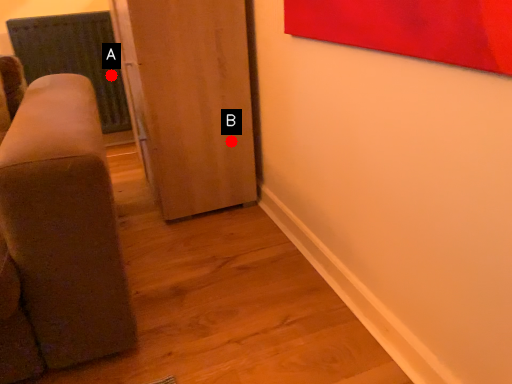
Question: Two points are circled on the image, labeled by A and B beside each circle. Which point is further to the camera?

Choices:
 (A) A is further
 (B) B is further

Answer: (A)